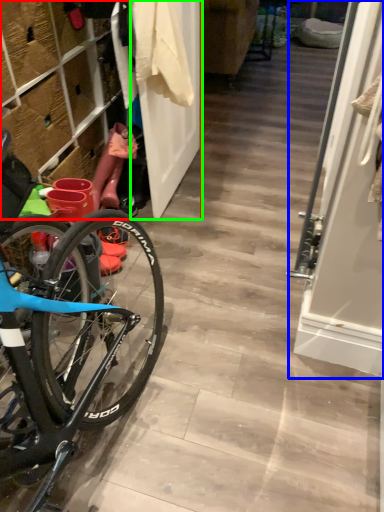
Question: Which is farther away from closet (highlighted by a red box)? screen door (highlighted by a blue box) or door (highlighted by a green box)?

Choices:
 (A) screen door
 (B) door

Answer: (A)